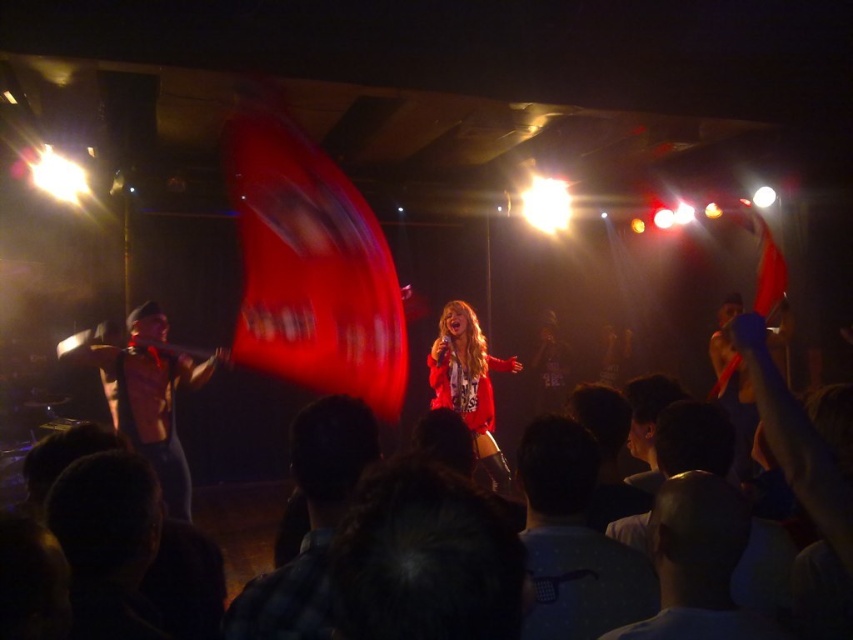
Question: Does smooth white shirt at lower center appear on the right side of matte red jacket at center?

Choices:
 (A) no
 (B) yes

Answer: (B)

Question: Is shiny silver sword at left positioned behind matte red jacket at center?

Choices:
 (A) no
 (B) yes

Answer: (A)

Question: Is smooth white shirt at lower center wider than shiny silver sword at left?

Choices:
 (A) no
 (B) yes

Answer: (A)

Question: Among these objects, which one is nearest to the camera?

Choices:
 (A) plaid shirt at center
 (B) dark gray cotton shirt at lower right

Answer: (A)

Question: Considering the real-world distances, which object is farthest from the shiny silver sword at left?

Choices:
 (A) plaid shirt at center
 (B) matte red jacket at center
 (C) smooth white shirt at lower center
 (D) dark gray cotton shirt at lower right

Answer: (C)

Question: Estimate the real-world distances between objects in this image. Which object is closer to the matte red jacket at center?

Choices:
 (A) dark gray cotton shirt at lower right
 (B) smooth white shirt at lower center
 (C) plaid shirt at center

Answer: (A)